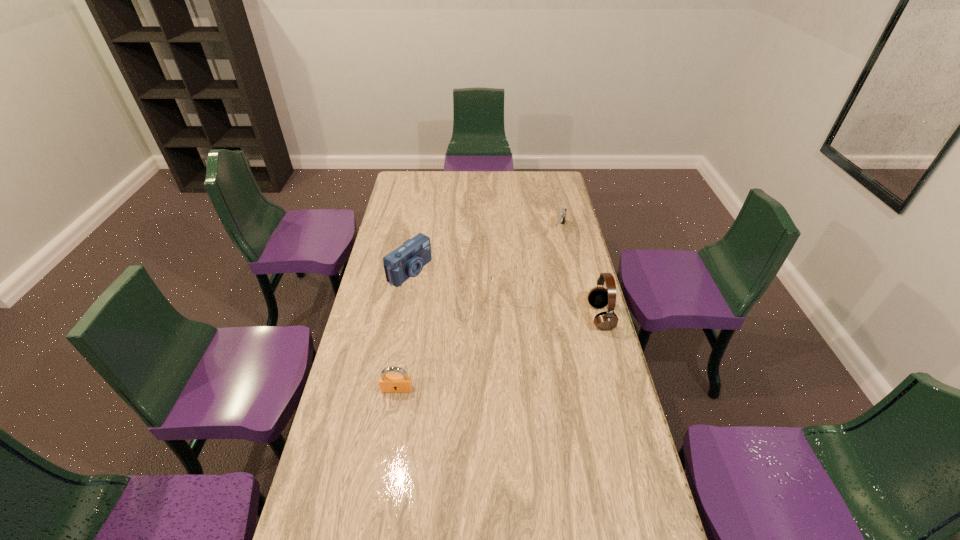
The height and width of the screenshot is (540, 960). In order to click on free space between the camera and the third object from left to right in this screenshot , I will do [x=461, y=281].

Locate an element on the screen. The image size is (960, 540). empty location between the camera and the padlock is located at coordinates (403, 330).

This screenshot has height=540, width=960. I want to click on free space between the spectacles and the padlock, so click(454, 340).

The image size is (960, 540). I want to click on free area in between the third object from left to right and the nearest object, so click(x=454, y=340).

You are a GUI agent. You are given a task and a screenshot of the screen. Output one action in this format:
    pyautogui.click(x=<x>, y=<y>)
    Task: Click on the free space between the headset and the camera
    
    Given the screenshot: What is the action you would take?
    pyautogui.click(x=505, y=294)

This screenshot has height=540, width=960. I want to click on free spot between the gun and the camera, so 485,251.

You are a GUI agent. You are given a task and a screenshot of the screen. Output one action in this format:
    pyautogui.click(x=<x>, y=<y>)
    Task: Click on the free point between the camera and the nearest object
    Image resolution: width=960 pixels, height=540 pixels.
    Given the screenshot: What is the action you would take?
    pyautogui.click(x=403, y=330)

Where is `vacant point located between the gun and the nearest object`? This screenshot has height=540, width=960. vacant point located between the gun and the nearest object is located at coordinates (478, 310).

You are a GUI agent. You are given a task and a screenshot of the screen. Output one action in this format:
    pyautogui.click(x=<x>, y=<y>)
    Task: Click on the object that is the fourth closest one to the camera
    
    Given the screenshot: What is the action you would take?
    point(598,297)

Locate which object is the third closest to the third object from left to right. Please provide its 2D coordinates. Your answer should be formatted as a tuple, i.e. [(x, y)], where the tuple contains the x and y coordinates of a point satisfying the conditions above.

[(562, 214)]